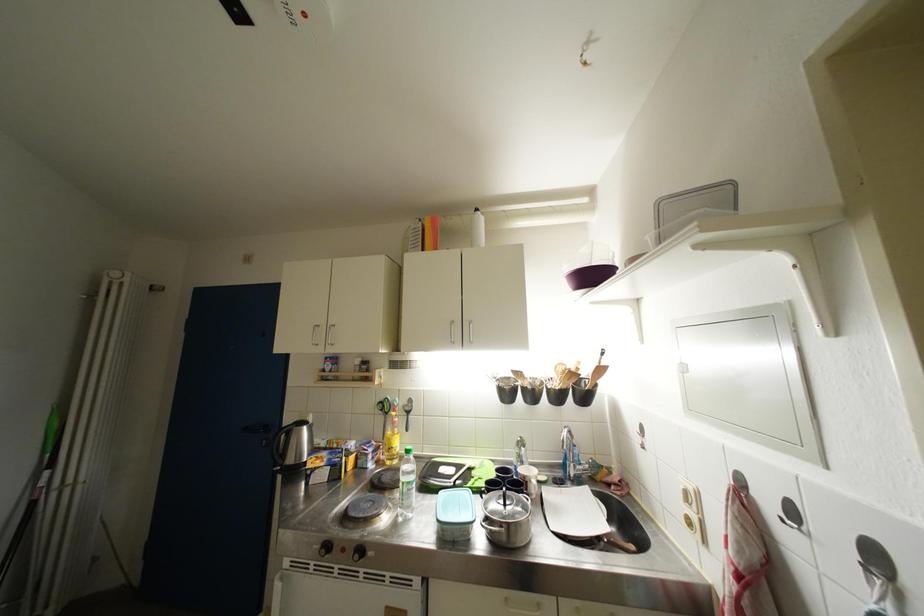
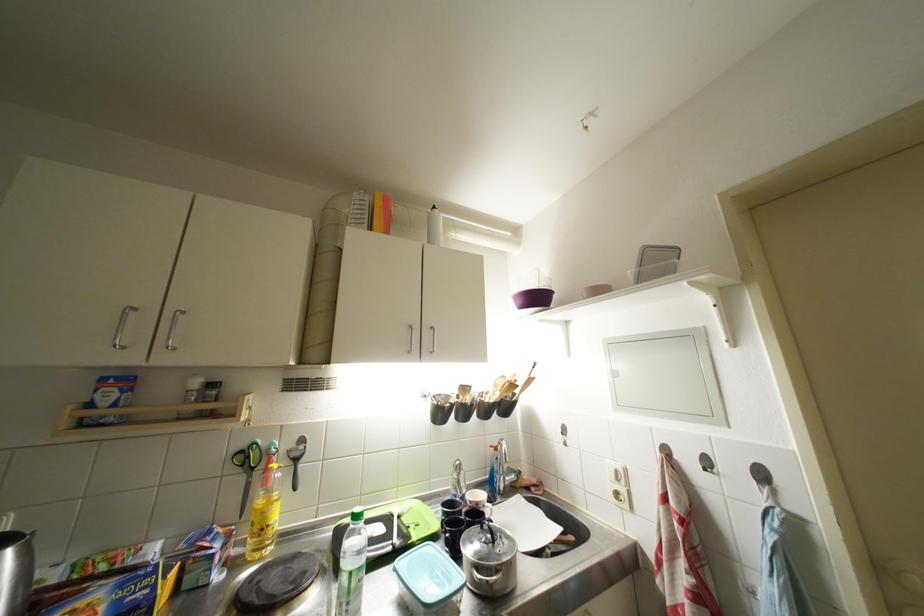
Locate, in the second image, the point that corresponds to the point at 412,408 in the first image.

(299, 450)